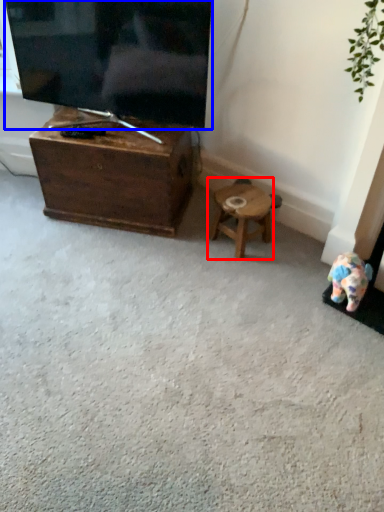
Question: Which point is further to the camera, stool (highlighted by a red box) or television (highlighted by a blue box)?

Choices:
 (A) stool
 (B) television

Answer: (A)